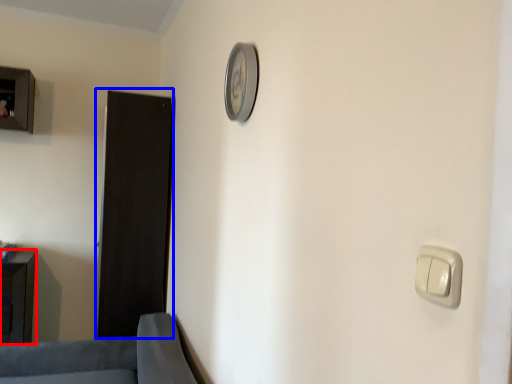
Question: Among these objects, which one is farthest to the camera, furniture (highlighted by a red box) or door (highlighted by a blue box)?

Choices:
 (A) furniture
 (B) door

Answer: (B)